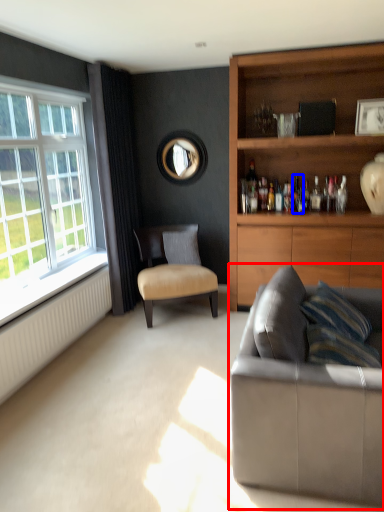
Question: Which object is further to the camera taking this photo, studio couch (highlighted by a red box) or bottle (highlighted by a blue box)?

Choices:
 (A) studio couch
 (B) bottle

Answer: (B)